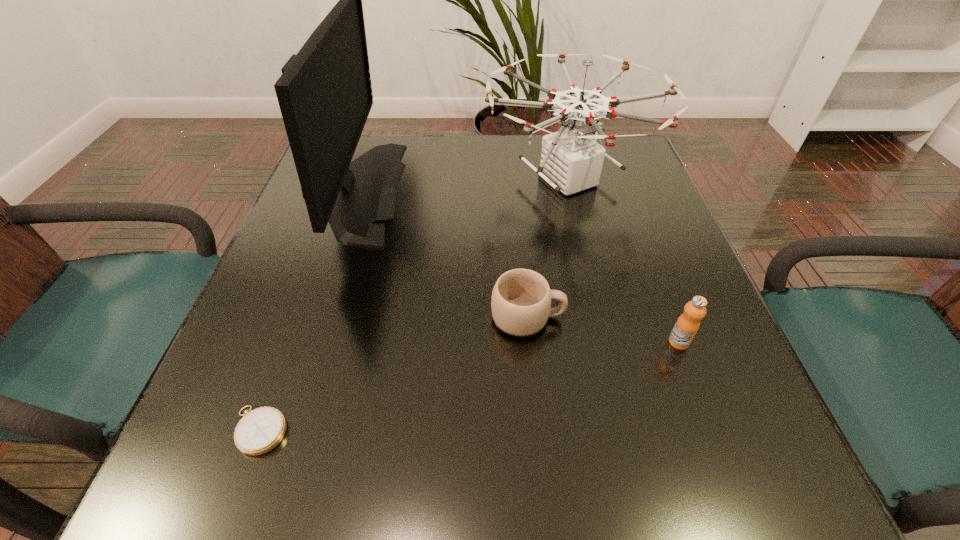
Image resolution: width=960 pixels, height=540 pixels. Find the location of `vacant space that's between the third shortest object and the monitor`. vacant space that's between the third shortest object and the monitor is located at coordinates (516, 266).

This screenshot has height=540, width=960. I want to click on unoccupied area between the third shortest object and the fourth tallest object, so click(603, 330).

Where is `vacant area that lies between the fourth tallest object and the third tallest object`? vacant area that lies between the fourth tallest object and the third tallest object is located at coordinates (603, 330).

This screenshot has height=540, width=960. I want to click on free space between the nearest object and the tallest object, so click(306, 310).

The image size is (960, 540). In order to click on unoccupied area between the shortest object and the tallest object in this screenshot , I will do [306, 310].

Locate an element on the screen. This screenshot has width=960, height=540. unoccupied position between the orange juice and the second shortest object is located at coordinates (603, 330).

What are the coordinates of `vacant space that's between the fourth tallest object and the tallest object` in the screenshot? It's located at (440, 254).

You are a GUI agent. You are given a task and a screenshot of the screen. Output one action in this format:
    pyautogui.click(x=<x>, y=<y>)
    Task: Click on the object that is the closest to the drone
    The image size is (960, 540).
    Given the screenshot: What is the action you would take?
    pyautogui.click(x=521, y=299)

Select which object appears as the fourth closest to the third tallest object. Please provide its 2D coordinates. Your answer should be formatted as a tuple, i.e. [(x, y)], where the tuple contains the x and y coordinates of a point satisfying the conditions above.

[(262, 429)]